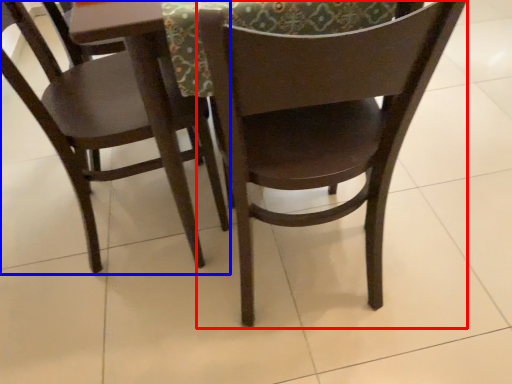
Question: Among these objects, which one is farthest to the camera, chair (highlighted by a red box) or chair (highlighted by a blue box)?

Choices:
 (A) chair
 (B) chair

Answer: (B)